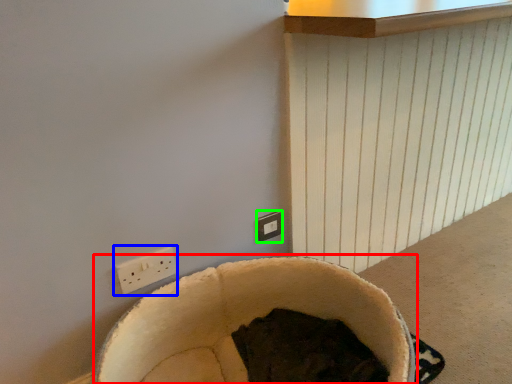
Question: Which object is the farthest from bean bag chair (highlighted by a red box)? Choose among these: power plugs and sockets (highlighted by a blue box) or electric outlet (highlighted by a green box).

Choices:
 (A) power plugs and sockets
 (B) electric outlet

Answer: (B)